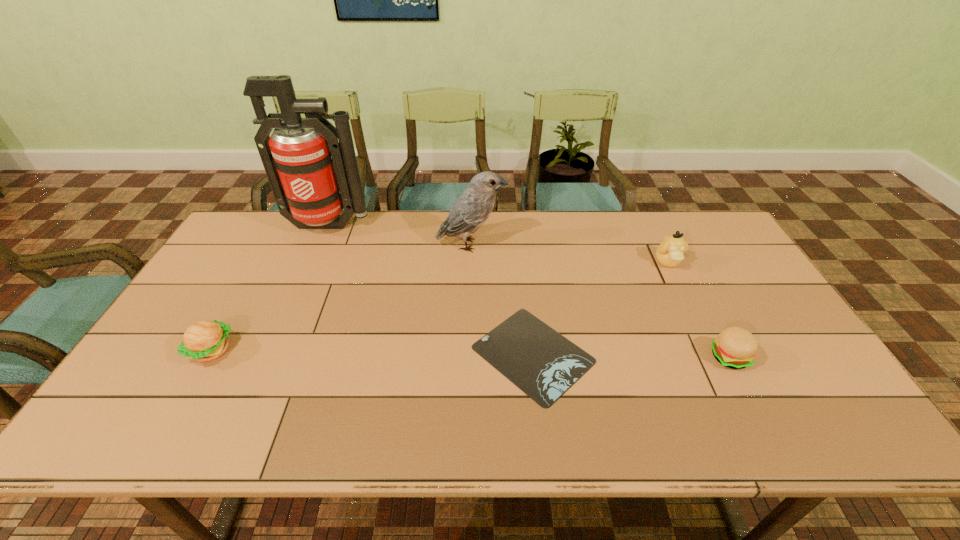
This screenshot has height=540, width=960. What are the coordinates of `free location located 0.070m on the left of the right hamburger` in the screenshot? It's located at (684, 357).

Locate an element on the screen. Image resolution: width=960 pixels, height=540 pixels. free space located 0.240m on the right of the shortest object is located at coordinates (688, 354).

Where is `fire extinguisher that is positioned at the far edge`? The height and width of the screenshot is (540, 960). fire extinguisher that is positioned at the far edge is located at coordinates (313, 176).

Identify the location of parrot located at the far edge. (472, 208).

You are a GUI agent. You are given a task and a screenshot of the screen. Output one action in this format:
    pyautogui.click(x=<x>, y=<y>)
    Task: Click on the duckling that is positioned at the far edge
    The image size is (960, 540).
    Given the screenshot: What is the action you would take?
    pyautogui.click(x=669, y=253)

This screenshot has height=540, width=960. I want to click on object that is at the near edge, so click(x=541, y=362).

The height and width of the screenshot is (540, 960). In order to click on object that is positioned at the left edge in this screenshot , I will do `click(203, 341)`.

Where is `object present at the right edge`? The image size is (960, 540). object present at the right edge is located at coordinates 735,347.

This screenshot has height=540, width=960. I want to click on vacant space at the far edge of the desktop, so click(x=624, y=224).

Where is `vacant space at the near edge of the desktop`? The image size is (960, 540). vacant space at the near edge of the desktop is located at coordinates (328, 437).